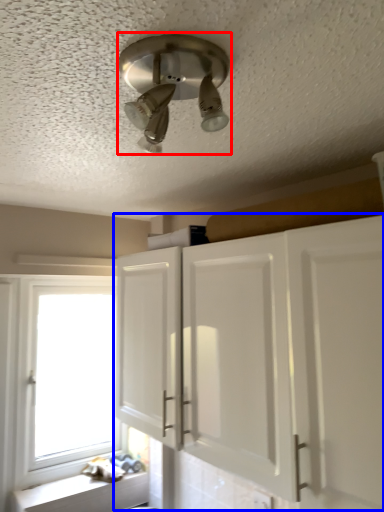
Question: Which object is closer to the camera taking this photo, light fixture (highlighted by a red box) or cabinetry (highlighted by a blue box)?

Choices:
 (A) light fixture
 (B) cabinetry

Answer: (A)